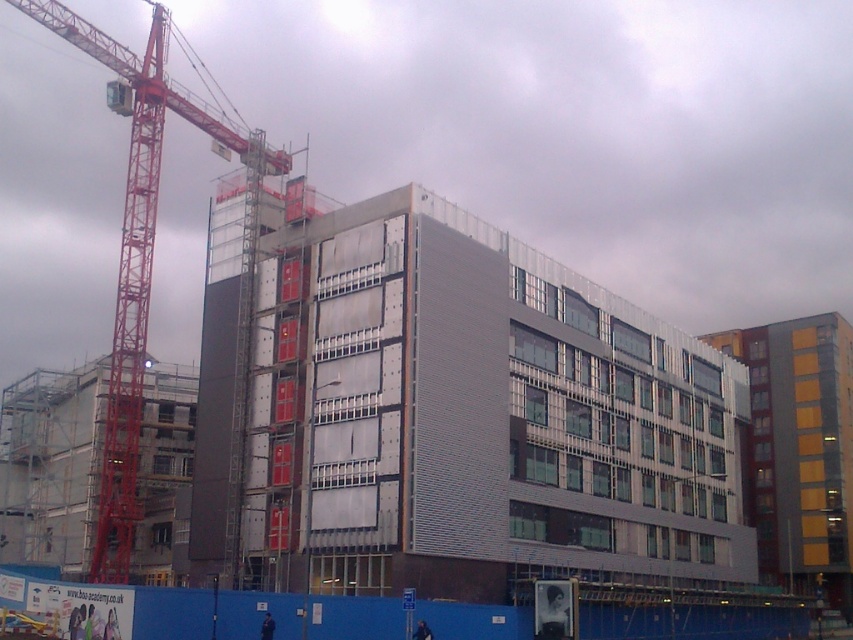
Looking at this image, does blue plastic fence at lower center have a greater width compared to red metal crane at left?

No.

Is blue plastic fence at lower center behind red metal crane at left?

No.

Is point (115, 604) more distant than point (196, 124)?

No, it is in front of (196, 124).

Identify the location of blue plastic fence at lower center. pyautogui.click(x=149, y=609).

Is metallic gray building at center further to the viewer compared to red metal crane at left?

No.

Looking at this image, can you confirm if metallic gray building at center is positioned above red metal crane at left?

No.

Who is more forward, (529, 371) or (144, 147)?

Result: Point (529, 371)

Locate an element on the screen. The image size is (853, 640). metallic gray building at center is located at coordinates (476, 410).

Is point (361, 339) more distant than point (47, 620)?

Yes, it is.

Is point (602, 429) positioned behind point (595, 609)?

Yes, point (602, 429) is farther from viewer.

Find the location of a particular element. The image size is (853, 640). metallic gray building at center is located at coordinates (476, 410).